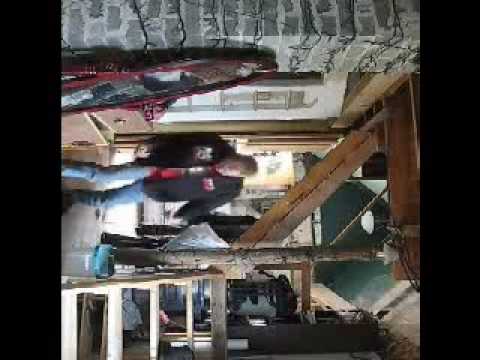
The height and width of the screenshot is (360, 480). Identify the location of shelf. pos(354,336).